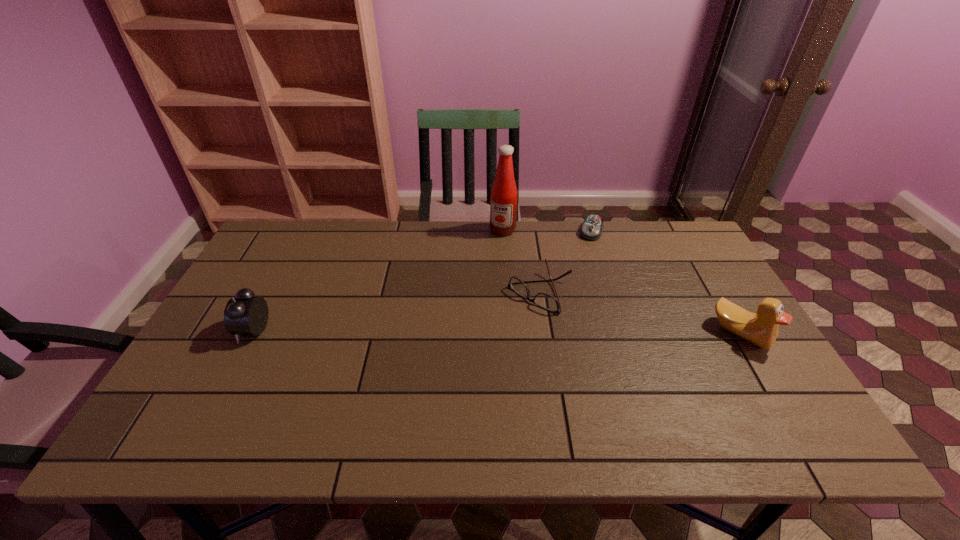
Identify the location of vacant position located on the front-facing side of the condiment. coord(469,293).

Locate an element on the screen. Image resolution: width=960 pixels, height=540 pixels. blank space located on the wheel side of the second object from right to left is located at coordinates (570, 294).

The image size is (960, 540). Find the location of `vacant space positioned 0.070m on the wheel side of the second object from right to left`. vacant space positioned 0.070m on the wheel side of the second object from right to left is located at coordinates tap(585, 253).

Locate an element on the screen. The height and width of the screenshot is (540, 960). free location located on the wheel side of the second object from right to left is located at coordinates (564, 309).

The height and width of the screenshot is (540, 960). Find the location of `vacant region located 0.130m on the front-facing side of the spectacles`. vacant region located 0.130m on the front-facing side of the spectacles is located at coordinates (492, 336).

What are the coordinates of `free space located 0.200m on the front-facing side of the spectacles` in the screenshot? It's located at (473, 352).

This screenshot has height=540, width=960. In order to click on vacant area located 0.070m on the front-facing side of the spectacles in this screenshot , I will do `click(505, 323)`.

The image size is (960, 540). Find the location of `condiment located in the far edge section of the desktop`. condiment located in the far edge section of the desktop is located at coordinates (503, 207).

Identify the location of computer mouse that is at the far edge. This screenshot has height=540, width=960. click(592, 227).

Locate an element on the screen. This screenshot has height=540, width=960. object present at the left edge is located at coordinates (x=244, y=314).